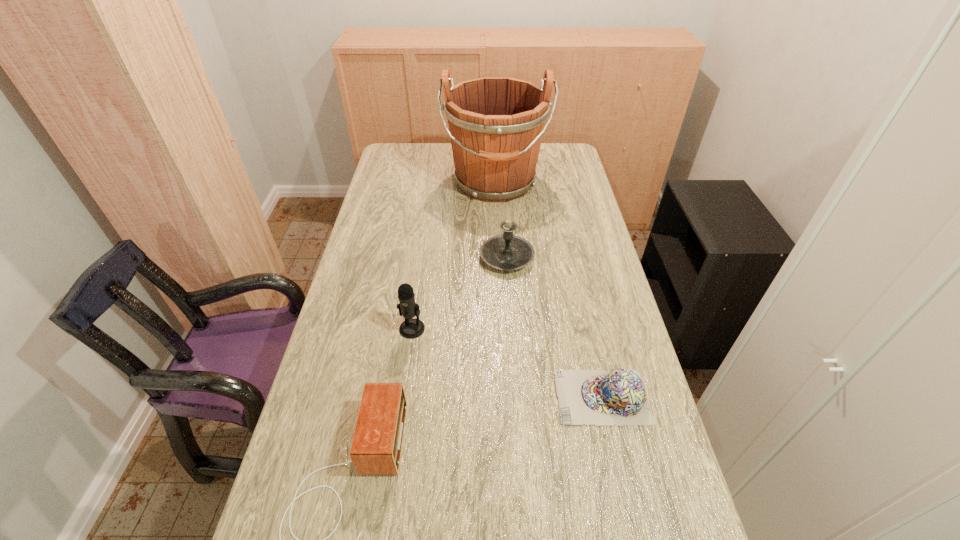
Locate an element on the screen. The width and height of the screenshot is (960, 540). vacant position located 0.140m on the front, side, and top of the shortest object is located at coordinates (500, 397).

Identify the location of object present at the far edge. The width and height of the screenshot is (960, 540). (496, 124).

Identify the location of bucket that is at the right edge. Image resolution: width=960 pixels, height=540 pixels. (496, 124).

Locate an element on the screen. This screenshot has height=540, width=960. cap at the right edge is located at coordinates (592, 397).

What are the coordinates of `object that is at the far right corner` in the screenshot? It's located at (496, 124).

Image resolution: width=960 pixels, height=540 pixels. In order to click on free space at the left edge of the desktop in this screenshot , I will do `click(407, 206)`.

Find the location of a particular element. free space at the right edge of the desktop is located at coordinates (672, 508).

The height and width of the screenshot is (540, 960). Identify the location of empty space between the microphone and the farthest object. (453, 256).

Locate an element on the screen. free spot between the fourth nearest object and the shortest object is located at coordinates (555, 327).

The image size is (960, 540). Identify the location of free space that is in between the second farthest object and the cap. (555, 327).